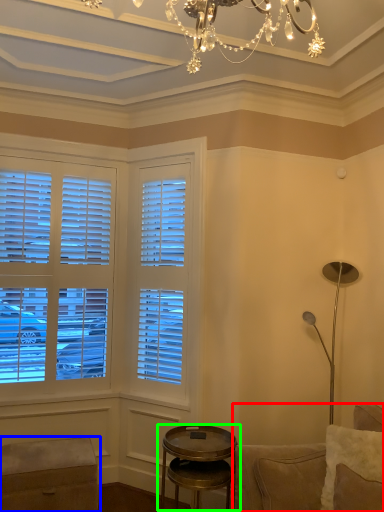
Question: Which is nearer to the studio couch (highlighted by a red box)? music stool (highlighted by a blue box) or table (highlighted by a green box).

Choices:
 (A) music stool
 (B) table

Answer: (B)